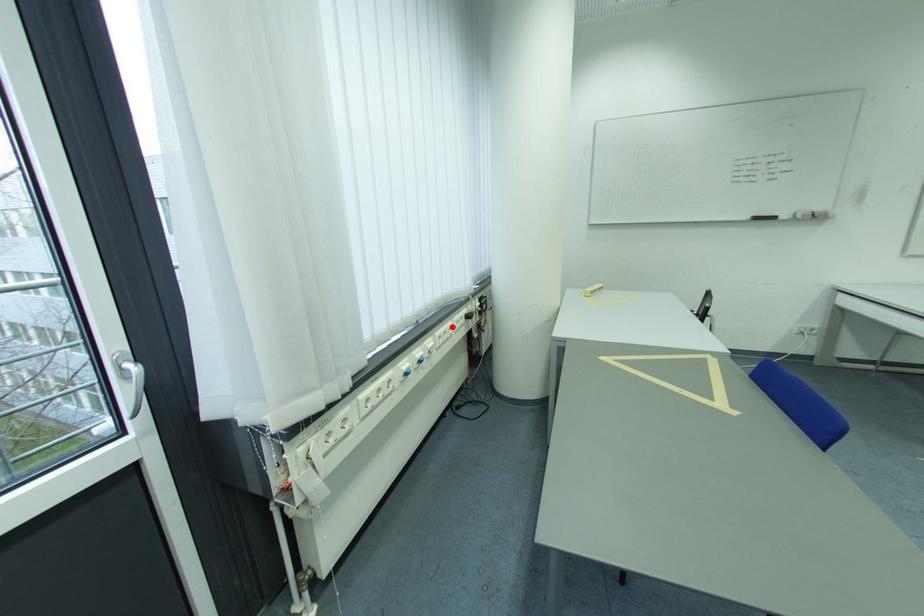
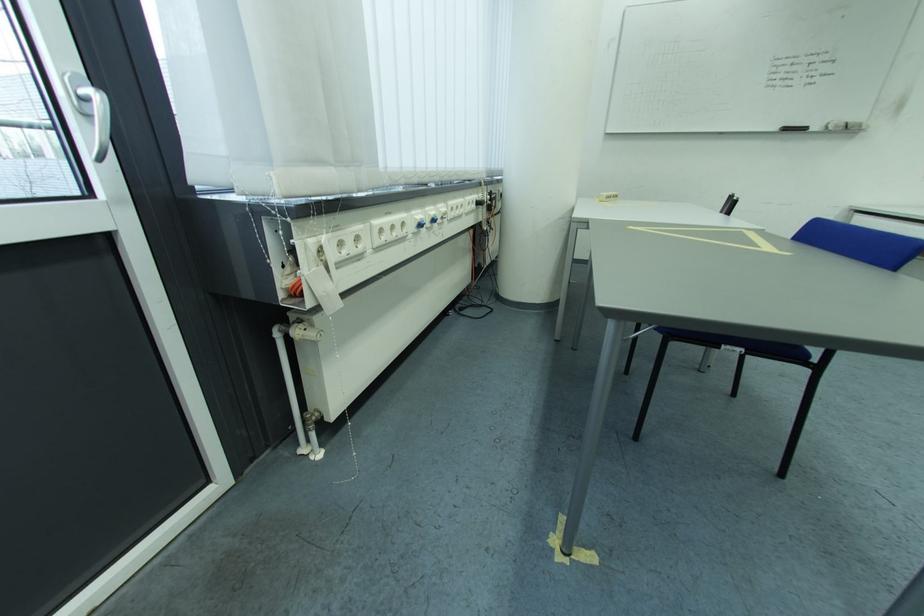
Where in the second image is the point corresponding to the highlighted location from the first image?

(465, 200)